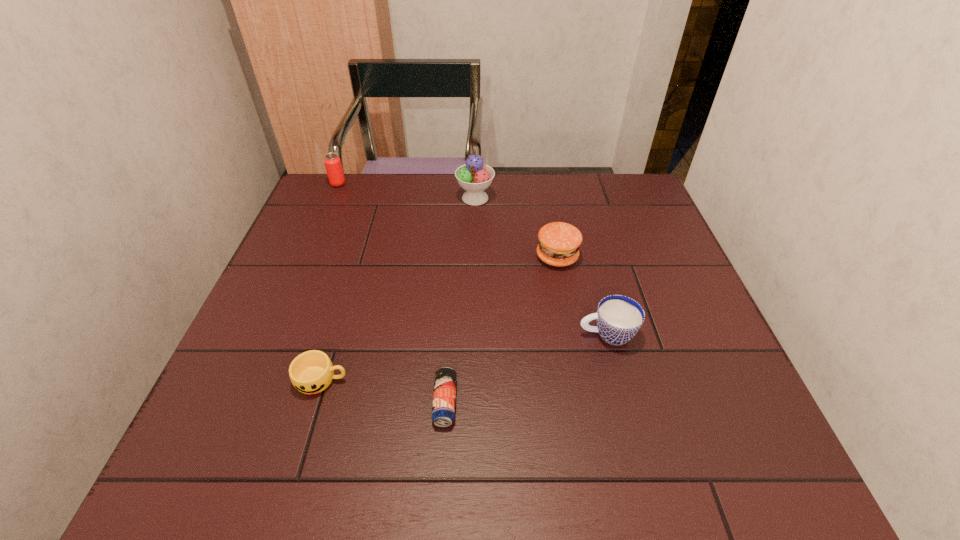
Where is `free space between the leftmost object and the right beer can`? The image size is (960, 540). free space between the leftmost object and the right beer can is located at coordinates (392, 293).

The image size is (960, 540). I want to click on free space between the third farthest object and the right beer can, so click(501, 329).

You are a GUI agent. You are given a task and a screenshot of the screen. Output one action in this format:
    pyautogui.click(x=<x>, y=<y>)
    Task: Click on the free space between the third shortest object and the patty
    
    Given the screenshot: What is the action you would take?
    pyautogui.click(x=582, y=296)

This screenshot has width=960, height=540. I want to click on free space between the icecream and the right cup, so click(x=541, y=266).

You are a GUI agent. You are given a task and a screenshot of the screen. Output one action in this format:
    pyautogui.click(x=<x>, y=<y>)
    Task: Click on the unoccupied position between the taller beer can and the right beer can
    
    Given the screenshot: What is the action you would take?
    pyautogui.click(x=392, y=293)

Locate an element on the screen. vacant space that's between the icecream and the fourth nearest object is located at coordinates (516, 227).

Identify the location of free area in between the third shortest object and the shorter beer can. (526, 368).

Select which object is the second closest to the shorter beer can. Please provide its 2D coordinates. Your answer should be formatted as a tuple, i.e. [(x, y)], where the tuple contains the x and y coordinates of a point satisfying the conditions above.

[(619, 318)]

Choose which object is the nearest neighbor to the fifth object from right to left. Please provide its 2D coordinates. Your answer should be formatted as a tuple, i.e. [(x, y)], where the tuple contains the x and y coordinates of a point satisfying the conditions above.

[(444, 396)]

This screenshot has height=540, width=960. In order to click on vacant position in the image that satisfies the following two spatial constraints: 1. on the side of the third nearest object with the handle; 2. on the front side of the right beer can in this screenshot , I will do `click(625, 402)`.